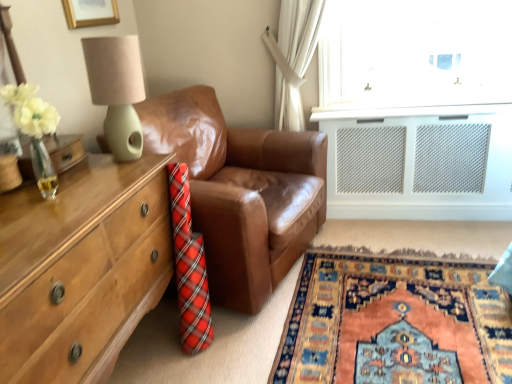
The height and width of the screenshot is (384, 512). What do you see at coordinates (241, 192) in the screenshot?
I see `brown leather couch at center` at bounding box center [241, 192].

The width and height of the screenshot is (512, 384). I want to click on wooden chest of drawers at left, so click(80, 266).

Would you say brown leather couch at center is a long distance from wooden chest of drawers at left?

Actually, brown leather couch at center and wooden chest of drawers at left are a little close together.

From a real-world perspective, is brown leather couch at center above or below wooden chest of drawers at left?

Clearly, from a real-world perspective, brown leather couch at center is above wooden chest of drawers at left.

Could you tell me if brown leather couch at center is facing wooden chest of drawers at left?

No, brown leather couch at center is not turned towards wooden chest of drawers at left.

Is brown leather couch at center situated inside wooden chest of drawers at left or outside?

The correct answer is: outside.

Where is `studio couch lying on the right of matte green lamp at upper left`? studio couch lying on the right of matte green lamp at upper left is located at coordinates (241, 192).

Consider the image. Between brown leather couch at center and matte green lamp at upper left, which one has smaller width?

matte green lamp at upper left is thinner.

Is brown leather couch at center next to matte green lamp at upper left?

No, brown leather couch at center is not beside matte green lamp at upper left.

From a real-world perspective, is brown leather couch at center physically above matte green lamp at upper left?

No, from a real-world perspective, brown leather couch at center is not above matte green lamp at upper left.

Based on the photo, from the image's perspective, does wooden chest of drawers at left appear lower than matte green lamp at upper left?

Yes, from the image's perspective, wooden chest of drawers at left is below matte green lamp at upper left.

Who is taller, wooden chest of drawers at left or matte green lamp at upper left?

wooden chest of drawers at left.

What's the angular difference between wooden chest of drawers at left and matte green lamp at upper left's facing directions?

The facing directions of wooden chest of drawers at left and matte green lamp at upper left are 1.45e-05 degrees apart.

Which of these two, carpet with intricate patterns at lower right or matte green lamp at upper left, is bigger?

carpet with intricate patterns at lower right.

Between carpet with intricate patterns at lower right and matte green lamp at upper left, which one has more height?

Standing taller between the two is matte green lamp at upper left.

Consider the image. From a real-world perspective, is carpet with intricate patterns at lower right physically located above or below matte green lamp at upper left?

carpet with intricate patterns at lower right is situated lower than matte green lamp at upper left in the real world.

Is carpet with intricate patterns at lower right facing towards matte green lamp at upper left?

No.

Is matte green lamp at upper left positioned with its back to brown leather couch at center?

No, brown leather couch at center is not at the back of matte green lamp at upper left.

From the picture: Is matte green lamp at upper left wider or thinner than brown leather couch at center?

Clearly, matte green lamp at upper left has less width compared to brown leather couch at center.

Is matte green lamp at upper left taller than brown leather couch at center?

No, matte green lamp at upper left is not taller than brown leather couch at center.

Where is `studio couch beneath the matte green lamp at upper left (from a real-world perspective)`? studio couch beneath the matte green lamp at upper left (from a real-world perspective) is located at coordinates (241, 192).

Considering the points (319, 369) and (217, 217), which point is in front, point (319, 369) or point (217, 217)?

The point (319, 369) is more forward.

Considering the sizes of objects carpet with intricate patterns at lower right and brown leather couch at center in the image provided, who is thinner, carpet with intricate patterns at lower right or brown leather couch at center?

brown leather couch at center.

Can you confirm if carpet with intricate patterns at lower right is positioned to the left of brown leather couch at center?

In fact, carpet with intricate patterns at lower right is to the right of brown leather couch at center.

Where is `chest of drawers on the left of matte green lamp at upper left`? This screenshot has height=384, width=512. chest of drawers on the left of matte green lamp at upper left is located at coordinates (80, 266).

Considering the sizes of objects matte green lamp at upper left and wooden chest of drawers at left in the image provided, who is wider, matte green lamp at upper left or wooden chest of drawers at left?

wooden chest of drawers at left is wider.

Is matte green lamp at upper left positioned with its back to wooden chest of drawers at left?

That's not correct — matte green lamp at upper left is not looking away from wooden chest of drawers at left.

Where is `studio couch that appears on the right of wooden chest of drawers at left`? Image resolution: width=512 pixels, height=384 pixels. studio couch that appears on the right of wooden chest of drawers at left is located at coordinates (241, 192).

Identify the location of studio couch behind the matte green lamp at upper left. The height and width of the screenshot is (384, 512). (241, 192).

Based on the photo, estimate the real-world distances between objects in this image. Which object is closer to carpet with intricate patterns at lower right, wooden chest of drawers at left or matte green lamp at upper left?

wooden chest of drawers at left is positioned closer to the anchor carpet with intricate patterns at lower right.

Which object lies further to the anchor point carpet with intricate patterns at lower right, brown leather couch at center or matte green lamp at upper left?

Based on the image, matte green lamp at upper left appears to be further to carpet with intricate patterns at lower right.

Based on their spatial positions, is brown leather couch at center or wooden chest of drawers at left closer to carpet with intricate patterns at lower right?

brown leather couch at center lies closer to carpet with intricate patterns at lower right than the other object.

Which object lies nearer to the anchor point brown leather couch at center, matte green lamp at upper left or carpet with intricate patterns at lower right?

The object closer to brown leather couch at center is matte green lamp at upper left.

Looking at the image, which one is located closer to wooden chest of drawers at left, brown leather couch at center or matte green lamp at upper left?

Based on the image, matte green lamp at upper left appears to be nearer to wooden chest of drawers at left.

Estimate the real-world distances between objects in this image. Which object is further from wooden chest of drawers at left, matte green lamp at upper left or carpet with intricate patterns at lower right?

Among the two, carpet with intricate patterns at lower right is located further to wooden chest of drawers at left.

Which object lies further to the anchor point brown leather couch at center, carpet with intricate patterns at lower right or matte green lamp at upper left?

carpet with intricate patterns at lower right is positioned further to the anchor brown leather couch at center.

From the picture: From the image, which object appears to be nearer to carpet with intricate patterns at lower right, matte green lamp at upper left or wooden chest of drawers at left?

wooden chest of drawers at left is closer to carpet with intricate patterns at lower right.

This screenshot has width=512, height=384. What are the coordinates of `table lamp between wooden chest of drawers at left and carpet with intricate patterns at lower right in the horizontal direction` in the screenshot? It's located at (117, 90).

The image size is (512, 384). What are the coordinates of `studio couch between matte green lamp at upper left and wooden chest of drawers at left in the vertical direction` in the screenshot? It's located at (241, 192).

What are the coordinates of `studio couch between wooden chest of drawers at left and carpet with intricate patterns at lower right from left to right` in the screenshot? It's located at (241, 192).

Identify the location of studio couch located between matte green lamp at upper left and carpet with intricate patterns at lower right in the left-right direction. This screenshot has height=384, width=512. (241, 192).